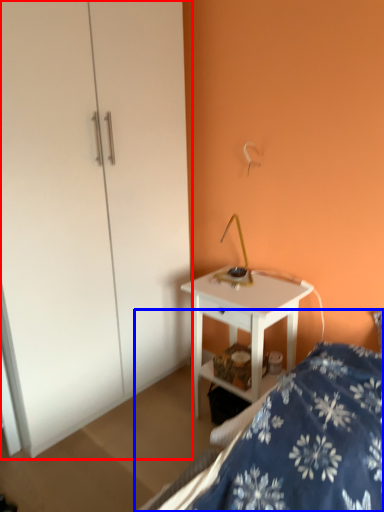
Question: Which object is closer to the camera taking this photo, dresser (highlighted by a red box) or bed (highlighted by a blue box)?

Choices:
 (A) dresser
 (B) bed

Answer: (B)